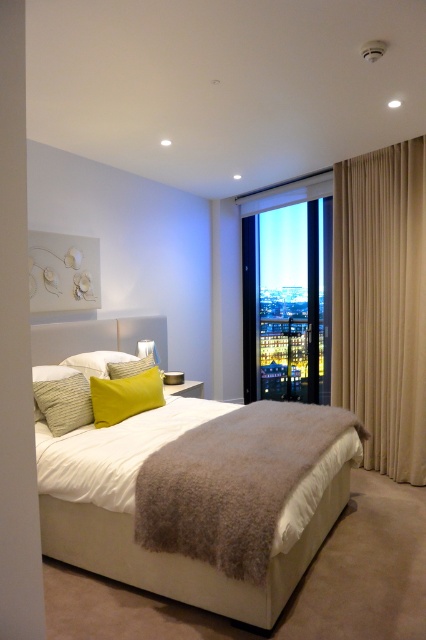
Which is more to the left, textured yellow pillow at left or yellow fabric pillow at upper left?

From the viewer's perspective, textured yellow pillow at left appears more on the left side.

Who is shorter, textured yellow pillow at left or yellow fabric pillow at upper left?

Standing shorter between the two is yellow fabric pillow at upper left.

Is point (42, 385) farther from viewer compared to point (149, 353)?

No, it is in front of (149, 353).

Locate an element on the screen. textured yellow pillow at left is located at coordinates (63, 403).

Between point (97, 403) and point (51, 413), which one is positioned in front?

Point (51, 413) is in front.

Which is behind, point (103, 412) or point (65, 387)?

The point (103, 412) is more distant.

Between point (106, 417) and point (51, 381), which one is positioned behind?

Point (106, 417)

Identify the location of yellow fabric pillow at center. (124, 396).

Is white soft bed at center wider than yellow fabric pillow at upper left?

Correct, the width of white soft bed at center exceeds that of yellow fabric pillow at upper left.

Can you confirm if white soft bed at center is positioned to the right of yellow fabric pillow at upper left?

Yes, white soft bed at center is to the right of yellow fabric pillow at upper left.

Between point (242, 515) and point (112, 365), which one is positioned behind?

Positioned behind is point (112, 365).

Where is `white soft bed at center`? The image size is (426, 640). white soft bed at center is located at coordinates (199, 499).